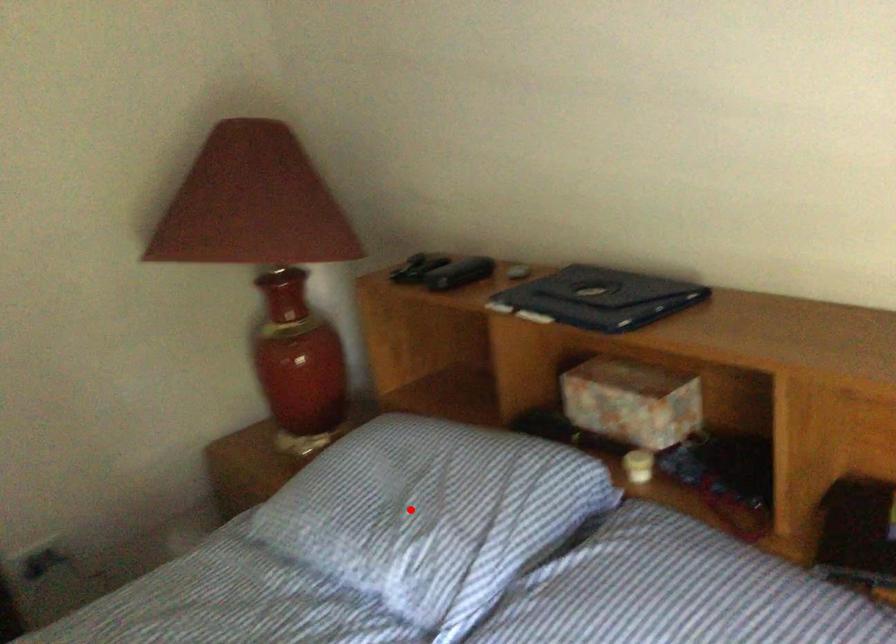
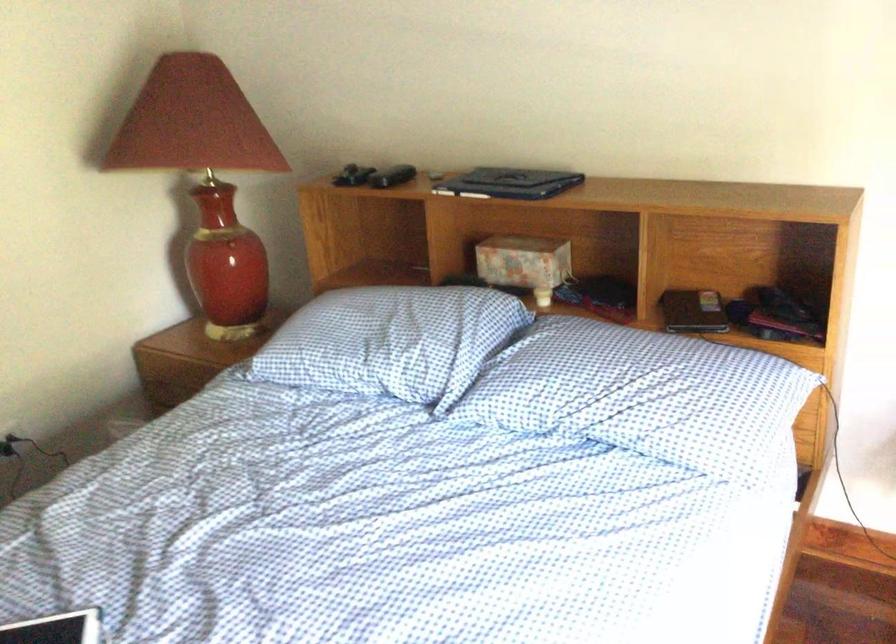
The point at the highlighted location is marked in the first image. Where is the corresponding point in the second image?

(384, 342)